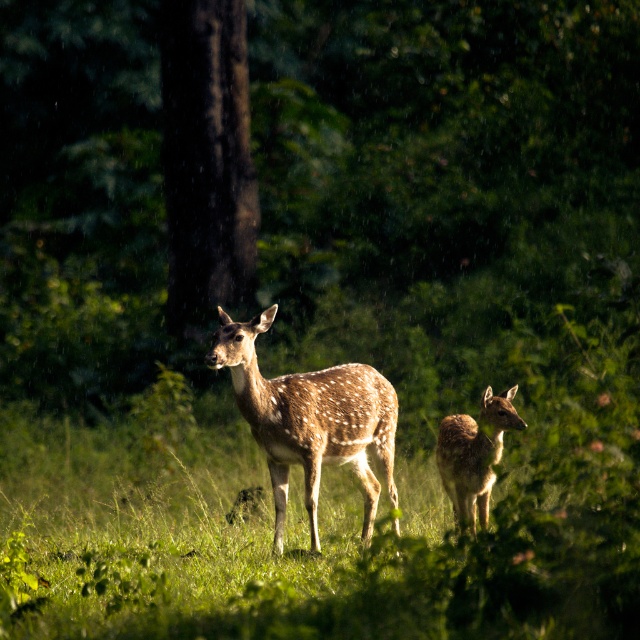
Can you confirm if spotted fur deer at center is smaller than spotted fur deer at right?

No.

Can you confirm if spotted fur deer at center is shorter than spotted fur deer at right?

No.

Between point (392, 426) and point (458, 467), which one is positioned behind?

Positioned behind is point (392, 426).

Where is `spotted fur deer at center`? spotted fur deer at center is located at coordinates 310,419.

Does brown textured tree at center appear on the right side of spotted fur deer at right?

Incorrect, brown textured tree at center is not on the right side of spotted fur deer at right.

Is brown textured tree at center below spotted fur deer at right?

Actually, brown textured tree at center is above spotted fur deer at right.

Find the location of a particular element. brown textured tree at center is located at coordinates (205, 161).

Who is more forward, (241,88) or (250,340)?

Point (250,340)

Find the location of a particular element. Image resolution: width=640 pixels, height=640 pixels. brown textured tree at center is located at coordinates (205, 161).